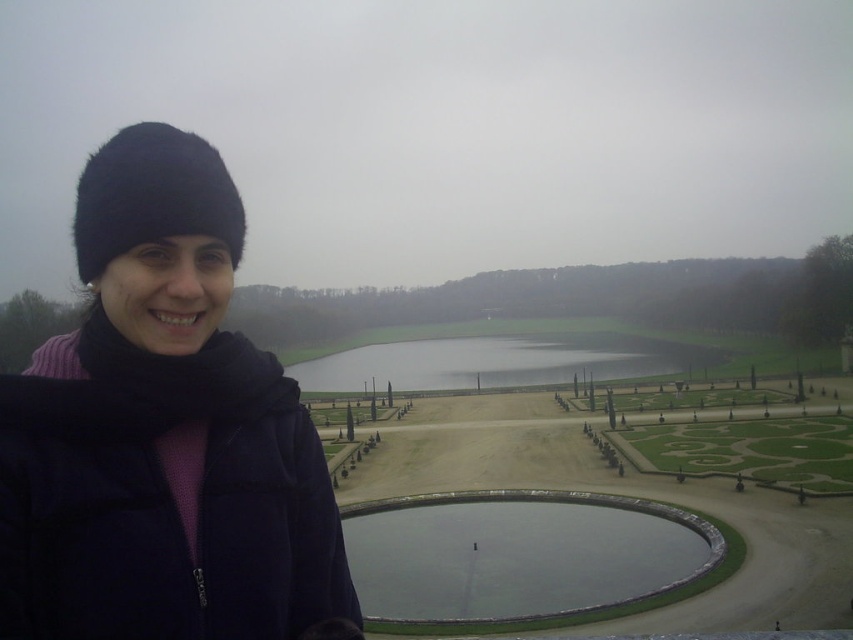
Question: Which object is the farthest from the clear glass pond at center?

Choices:
 (A) glossy concrete pond at center
 (B) dark blue fleece jacket at left
 (C) black fur hat at left

Answer: (A)

Question: Where is dark blue fleece jacket at left located in relation to glossy concrete pond at center in the image?

Choices:
 (A) below
 (B) above

Answer: (B)

Question: Considering the relative positions of dark blue fleece jacket at left and clear glass pond at center in the image provided, where is dark blue fleece jacket at left located with respect to clear glass pond at center?

Choices:
 (A) below
 (B) above

Answer: (B)

Question: Which point is closer to the camera?

Choices:
 (A) black fur hat at left
 (B) clear glass pond at center
 (C) dark blue fleece jacket at left
 (D) glossy concrete pond at center

Answer: (C)

Question: Does clear glass pond at center appear over black fur hat at left?

Choices:
 (A) yes
 (B) no

Answer: (B)

Question: Which point is closer to the camera?

Choices:
 (A) black fur hat at left
 (B) clear glass pond at center
 (C) dark blue fleece jacket at left

Answer: (C)